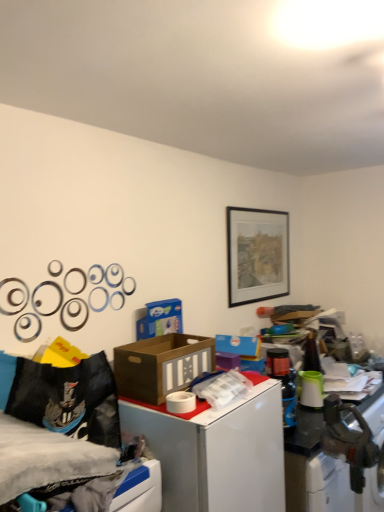
Question: From the image's perspective, does black matte picture frame at upper center appear lower than metallic silver washing machine at lower right?

Choices:
 (A) no
 (B) yes

Answer: (A)

Question: Is black matte picture frame at upper center facing away from metallic silver washing machine at lower right?

Choices:
 (A) yes
 (B) no

Answer: (B)

Question: Is black matte picture frame at upper center further to the viewer compared to metallic silver washing machine at lower right?

Choices:
 (A) no
 (B) yes

Answer: (B)

Question: From the image's perspective, is black matte picture frame at upper center on metallic silver washing machine at lower right?

Choices:
 (A) no
 (B) yes

Answer: (B)

Question: Can you confirm if black matte picture frame at upper center is smaller than metallic silver washing machine at lower right?

Choices:
 (A) yes
 (B) no

Answer: (A)

Question: Is brown cardboard box at center bigger or smaller than black fabric bed at lower left?

Choices:
 (A) big
 (B) small

Answer: (B)

Question: Looking at their shapes, would you say brown cardboard box at center is wider or thinner than black fabric bed at lower left?

Choices:
 (A) wide
 (B) thin

Answer: (B)

Question: In the image, is brown cardboard box at center on the left side or the right side of black fabric bed at lower left?

Choices:
 (A) left
 (B) right

Answer: (B)

Question: Does point (145, 343) appear closer or farther from the camera than point (24, 480)?

Choices:
 (A) closer
 (B) farther

Answer: (B)

Question: From the image's perspective, is black matte picture frame at upper center above or below black fabric bed at lower left?

Choices:
 (A) below
 (B) above

Answer: (B)

Question: Is black matte picture frame at upper center to the left or to the right of black fabric bed at lower left in the image?

Choices:
 (A) left
 (B) right

Answer: (B)

Question: In the image, is black matte picture frame at upper center positioned in front of or behind black fabric bed at lower left?

Choices:
 (A) front
 (B) behind

Answer: (B)

Question: In terms of width, does black matte picture frame at upper center look wider or thinner when compared to black fabric bed at lower left?

Choices:
 (A) wide
 (B) thin

Answer: (B)

Question: Is point (23, 370) positioned closer to the camera than point (190, 345)?

Choices:
 (A) closer
 (B) farther

Answer: (A)

Question: In terms of width, does black fabric bed at lower left look wider or thinner when compared to brown cardboard box at center?

Choices:
 (A) wide
 (B) thin

Answer: (A)